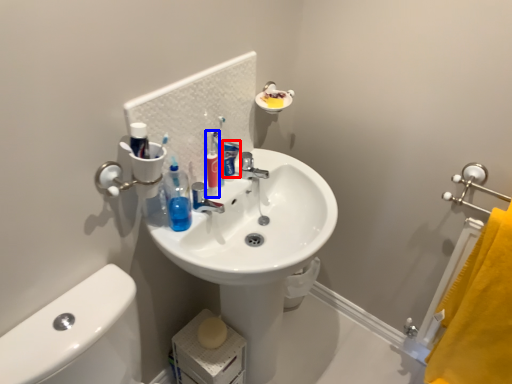
Question: Which of the following is the farthest to the observer, toothpaste (highlighted by a red box) or cleaning product (highlighted by a blue box)?

Choices:
 (A) toothpaste
 (B) cleaning product

Answer: (A)